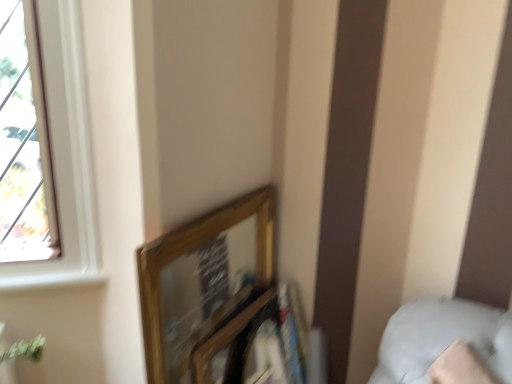
Question: Would you say white soft pillow at lower right is inside or outside wooden frame at upper center?

Choices:
 (A) inside
 (B) outside

Answer: (B)

Question: Looking at their shapes, would you say white soft pillow at lower right is wider or thinner than wooden frame at upper center?

Choices:
 (A) wide
 (B) thin

Answer: (A)

Question: Based on their sizes in the image, would you say white soft pillow at lower right is bigger or smaller than wooden frame at upper center?

Choices:
 (A) small
 (B) big

Answer: (B)

Question: From their relative heights in the image, would you say wooden frame at upper center is taller or shorter than white soft pillow at lower right?

Choices:
 (A) short
 (B) tall

Answer: (B)

Question: From a real-world perspective, relative to white soft pillow at lower right, is wooden frame at upper center vertically above or below?

Choices:
 (A) above
 (B) below

Answer: (B)

Question: Looking at their shapes, would you say wooden frame at upper center is wider or thinner than white soft pillow at lower right?

Choices:
 (A) wide
 (B) thin

Answer: (B)

Question: In the image, is wooden frame at upper center on the left side or the right side of white soft pillow at lower right?

Choices:
 (A) right
 (B) left

Answer: (B)